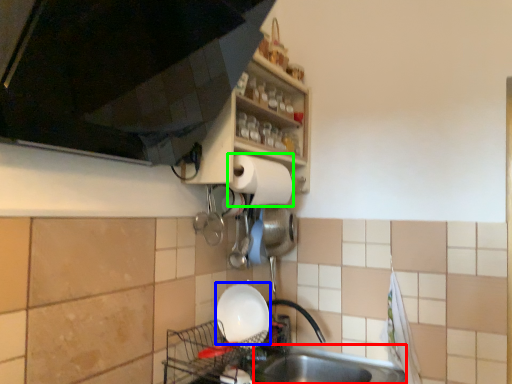
Question: Which object is the closest to the sink (highlighted by a red box)? Choose among these: basin (highlighted by a blue box) or paper towel (highlighted by a green box).

Choices:
 (A) basin
 (B) paper towel

Answer: (A)